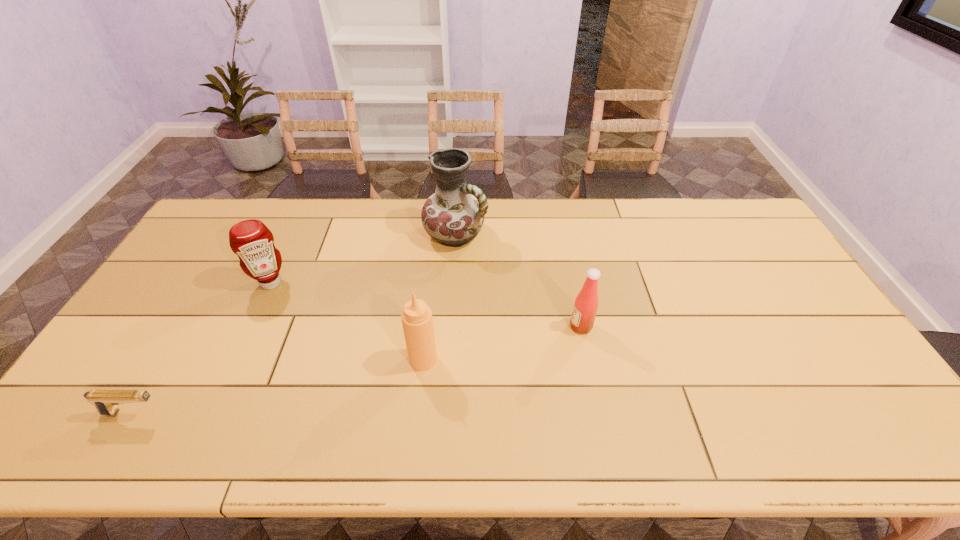
Locate an element on the screen. The image size is (960, 540). vacant region located 0.120m on the left of the tallest object is located at coordinates (389, 235).

Where is `free point located on the front of the fourth farthest object`? The image size is (960, 540). free point located on the front of the fourth farthest object is located at coordinates (413, 450).

This screenshot has height=540, width=960. In order to click on vacant space located 0.050m on the right of the leftmost condiment in this screenshot , I will do `click(304, 282)`.

Find the location of a particular element. The image size is (960, 540). vacant point located on the front-facing side of the rightmost object is located at coordinates (552, 327).

Locate an element on the screen. Image resolution: width=960 pixels, height=540 pixels. free space located on the front-facing side of the rightmost object is located at coordinates 446,327.

The width and height of the screenshot is (960, 540). Find the location of `blank area located on the front-facing side of the rightmost object`. blank area located on the front-facing side of the rightmost object is located at coordinates (468, 327).

Where is `blank area located 0.190m at the barrel of the pistol`? The image size is (960, 540). blank area located 0.190m at the barrel of the pistol is located at coordinates (243, 413).

Where is `object located at the far edge`? The height and width of the screenshot is (540, 960). object located at the far edge is located at coordinates (454, 215).

Where is `object positioned at the left edge`? object positioned at the left edge is located at coordinates (106, 401).

Locate an element on the screen. free space at the far edge of the desktop is located at coordinates (528, 208).